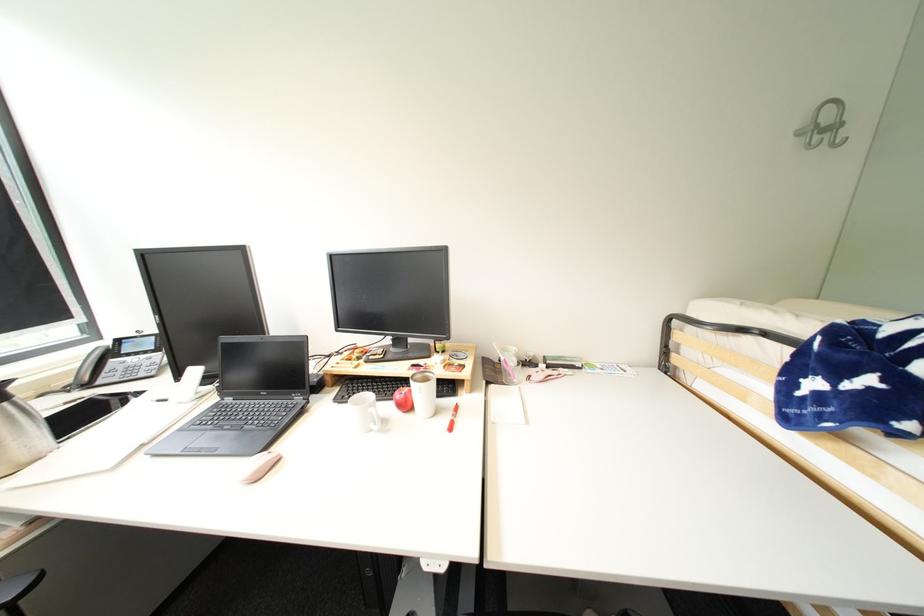
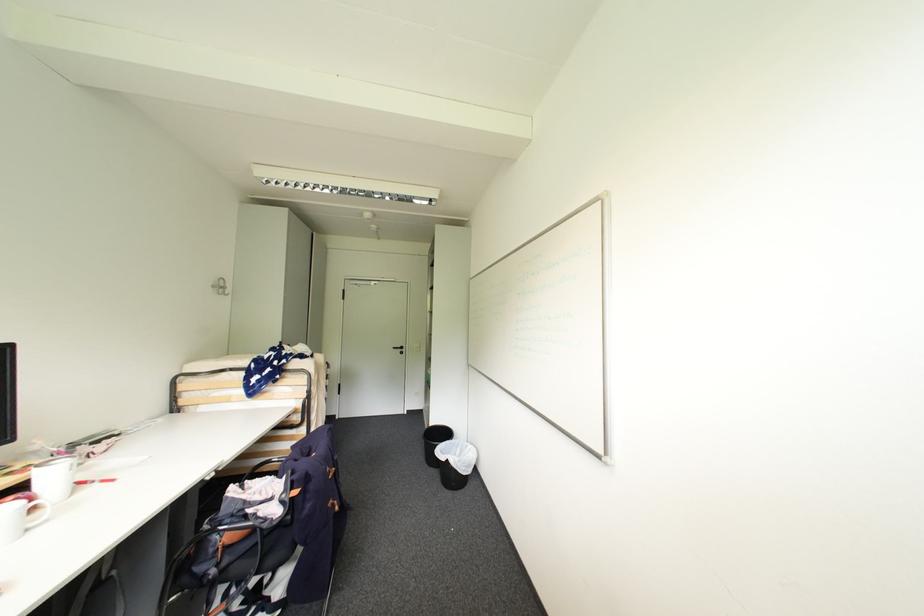
In the second image, find the point that corresponds to [807,132] in the first image.

(220, 286)